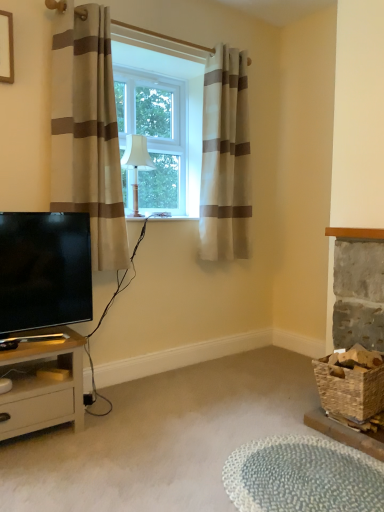
Question: Is the depth of beige striped curtain at left, which is the 2th curtain from back to front, less than that of light beige wood nightstand at lower left?

Choices:
 (A) no
 (B) yes

Answer: (A)

Question: Is the depth of beige striped curtain at left, which appears as the 1th curtain when viewed from the front, greater than that of light beige wood nightstand at lower left?

Choices:
 (A) yes
 (B) no

Answer: (A)

Question: Does beige striped curtain at left, which is the 2th curtain from back to front, turn towards light beige wood nightstand at lower left?

Choices:
 (A) no
 (B) yes

Answer: (A)

Question: Considering the relative positions of beige striped curtain at left, which is the 2th curtain from back to front, and light beige wood nightstand at lower left in the image provided, is beige striped curtain at left, which is the 2th curtain from back to front, to the left of light beige wood nightstand at lower left from the viewer's perspective?

Choices:
 (A) yes
 (B) no

Answer: (B)

Question: Considering the relative sizes of beige striped curtain at left, the 1th curtain from the left, and light beige wood nightstand at lower left in the image provided, is beige striped curtain at left, the 1th curtain from the left, bigger than light beige wood nightstand at lower left?

Choices:
 (A) no
 (B) yes

Answer: (B)

Question: Is beige striped curtain at left, which appears as the 1th curtain when viewed from the front, not within light beige wood nightstand at lower left?

Choices:
 (A) no
 (B) yes

Answer: (B)

Question: Is beige striped curtain at center, placed as the 2th curtain when sorted from front to back, facing towards light beige wood nightstand at lower left?

Choices:
 (A) no
 (B) yes

Answer: (A)

Question: From the image's perspective, is beige striped curtain at center, placed as the 2th curtain when sorted from front to back, beneath light beige wood nightstand at lower left?

Choices:
 (A) yes
 (B) no

Answer: (B)

Question: From a real-world perspective, is beige striped curtain at center, which ranks as the second curtain in left-to-right order, located higher than light beige wood nightstand at lower left?

Choices:
 (A) no
 (B) yes

Answer: (B)

Question: Is beige striped curtain at center, placed as the 2th curtain when sorted from front to back, bigger than light beige wood nightstand at lower left?

Choices:
 (A) yes
 (B) no

Answer: (A)

Question: From the image's perspective, is beige striped curtain at center, which is counted as the 1th curtain, starting from the right, above light beige wood nightstand at lower left?

Choices:
 (A) no
 (B) yes

Answer: (B)

Question: Can you confirm if beige striped curtain at center, which is counted as the 1th curtain, starting from the right, is wider than textured gray rug at lower center?

Choices:
 (A) yes
 (B) no

Answer: (B)